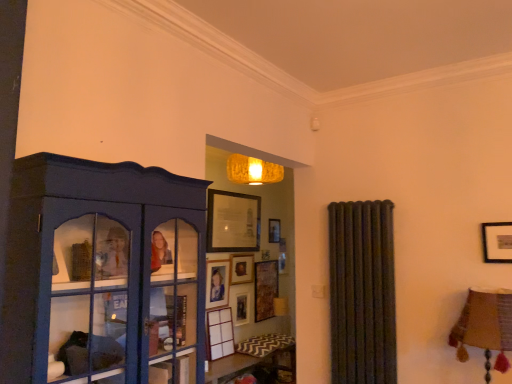
Question: Does matte blue cabinet at left turn towards wooden picture frame at center, which is counted as the second picture frame, starting from the top?

Choices:
 (A) no
 (B) yes

Answer: (A)

Question: Is matte blue cabinet at left located outside wooden picture frame at center, the 4th picture frame positioned from the bottom?

Choices:
 (A) yes
 (B) no

Answer: (A)

Question: Is matte blue cabinet at left surrounding wooden picture frame at center, which is counted as the second picture frame, starting from the top?

Choices:
 (A) yes
 (B) no

Answer: (B)

Question: From a real-world perspective, is matte blue cabinet at left on wooden picture frame at center, which is counted as the second picture frame, starting from the top?

Choices:
 (A) yes
 (B) no

Answer: (A)

Question: Is matte blue cabinet at left oriented away from wooden picture frame at center, which is counted as the second picture frame, starting from the top?

Choices:
 (A) yes
 (B) no

Answer: (B)

Question: From the image's perspective, would you say matte blue cabinet at left is positioned over wooden picture frame at center, which is counted as the second picture frame, starting from the top?

Choices:
 (A) yes
 (B) no

Answer: (A)

Question: Is matte black picture frame at center, the 3th picture frame from the bottom, bigger than wooden picture frame at center, the 4th picture frame positioned from the bottom?

Choices:
 (A) yes
 (B) no

Answer: (A)

Question: Does matte black picture frame at center, the third picture frame viewed from the top, come in front of wooden picture frame at center, the 4th picture frame positioned from the bottom?

Choices:
 (A) yes
 (B) no

Answer: (A)

Question: Is matte black picture frame at center, the third picture frame viewed from the top, positioned far away from wooden picture frame at center, which is counted as the second picture frame, starting from the top?

Choices:
 (A) yes
 (B) no

Answer: (B)

Question: Considering the relative sizes of matte black picture frame at center, the 3th picture frame from the bottom, and wooden picture frame at center, the 4th picture frame positioned from the bottom, in the image provided, is matte black picture frame at center, the 3th picture frame from the bottom, smaller than wooden picture frame at center, the 4th picture frame positioned from the bottom,?

Choices:
 (A) no
 (B) yes

Answer: (A)

Question: Does matte black picture frame at center, the 3th picture frame from the bottom, have a lesser height compared to wooden picture frame at center, the 4th picture frame positioned from the bottom?

Choices:
 (A) yes
 (B) no

Answer: (B)

Question: From the image's perspective, does matte black picture frame at center, the 3th picture frame from the bottom, appear lower than wooden picture frame at center, which is counted as the second picture frame, starting from the top?

Choices:
 (A) yes
 (B) no

Answer: (A)

Question: From a real-world perspective, does wooden picture frame at upper center, which ranks as the 5th picture frame in bottom-to-top order, sit lower than matte blue cabinet at left?

Choices:
 (A) no
 (B) yes

Answer: (A)